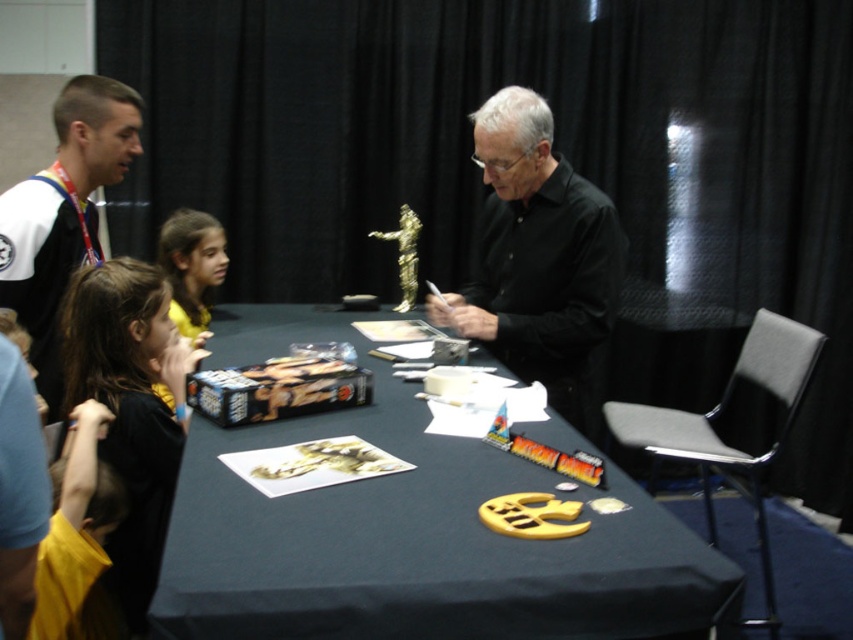
In the scene shown: Who is lower down, matte black table at center or yellow fabric shirt at lower left?

Positioned lower is yellow fabric shirt at lower left.

Who is positioned more to the right, matte black table at center or yellow fabric shirt at lower left?

matte black table at center

You are a GUI agent. You are given a task and a screenshot of the screen. Output one action in this format:
    pyautogui.click(x=<x>, y=<y>)
    Task: Click on the matte black table at center
    The width and height of the screenshot is (853, 640).
    Given the screenshot: What is the action you would take?
    pyautogui.click(x=409, y=532)

Locate an element on the screen. matte black table at center is located at coordinates (409, 532).

How distant is dark brown hair at left from white jersey at upper left?

They are 13.63 inches apart.

Who is more forward, (x=177, y=452) or (x=97, y=106)?

Positioned in front is point (x=177, y=452).

Where is `dark brown hair at left`? The height and width of the screenshot is (640, 853). dark brown hair at left is located at coordinates (131, 406).

This screenshot has width=853, height=640. I want to click on dark brown hair at left, so click(131, 406).

Is point (692, 536) positioned in front of point (154, 468)?

Yes, it is in front of point (154, 468).

Does matte black table at center appear on the right side of dark brown hair at left?

Indeed, matte black table at center is positioned on the right side of dark brown hair at left.

Does point (701, 576) come behind point (178, 448)?

No, (701, 576) is in front of (178, 448).

Where is `matte black table at center`? Image resolution: width=853 pixels, height=640 pixels. matte black table at center is located at coordinates (409, 532).